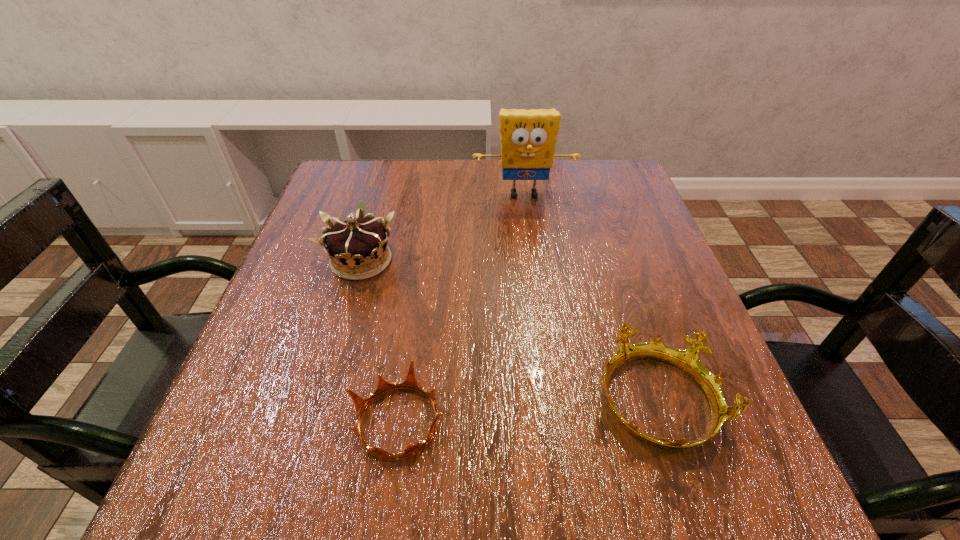
The height and width of the screenshot is (540, 960). In order to click on vacant region located 0.060m on the right of the shortest crown in this screenshot , I will do pyautogui.click(x=486, y=422).

Where is `object that is at the far edge`? The width and height of the screenshot is (960, 540). object that is at the far edge is located at coordinates (528, 137).

This screenshot has width=960, height=540. What are the coordinates of `object present at the left edge` in the screenshot? It's located at (358, 249).

Where is `sponge located in the right edge section of the desktop`? Image resolution: width=960 pixels, height=540 pixels. sponge located in the right edge section of the desktop is located at coordinates (528, 137).

Locate an element on the screen. Image resolution: width=960 pixels, height=540 pixels. crown positioned at the right edge is located at coordinates (687, 360).

Locate an element on the screen. object located at the far right corner is located at coordinates (528, 137).

The height and width of the screenshot is (540, 960). What are the coordinates of `object that is at the near right corner` in the screenshot? It's located at pos(687,360).

This screenshot has height=540, width=960. In order to click on vacant space at the far edge in this screenshot , I will do `click(559, 165)`.

Identify the location of vacant area at the near edge of the desktop. (491, 492).

At what (x,y) coordinates should I click in order to perform the action: click on free region at the left edge of the desktop. Please return your answer as a coordinate pair (x, y). The height and width of the screenshot is (540, 960). Looking at the image, I should click on (252, 412).